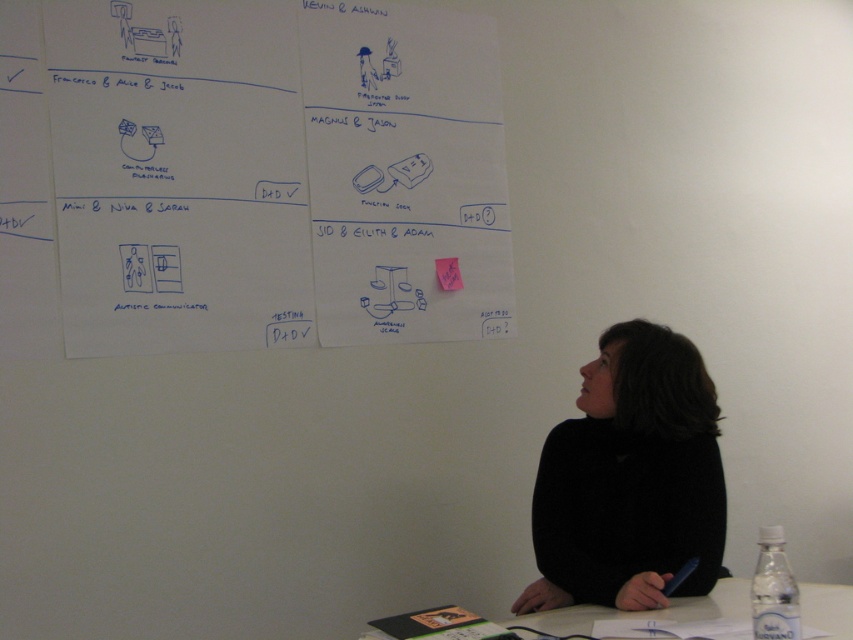
Can you confirm if black matte sweater at lower right is positioned above white plastic table at lower center?

Yes.

Image resolution: width=853 pixels, height=640 pixels. Describe the element at coordinates (630, 477) in the screenshot. I see `black matte sweater at lower right` at that location.

What are the coordinates of `black matte sweater at lower right` in the screenshot? It's located at (630, 477).

I want to click on white plastic table at lower center, so 650,611.

Between white plastic table at lower center and pink paper at center, which one has more height?

white plastic table at lower center

The image size is (853, 640). What are the coordinates of `white plastic table at lower center` in the screenshot? It's located at (650, 611).

This screenshot has width=853, height=640. What are the coordinates of `white plastic table at lower center` in the screenshot? It's located at (650, 611).

Based on the photo, between black matte sweater at lower right and pink paper at center, which one is positioned higher?

pink paper at center is above.

Does black matte sweater at lower right have a greater height compared to pink paper at center?

Yes.

Does point (657, 349) come closer to viewer compared to point (440, 285)?

That is True.

At what (x,y) coordinates should I click in order to perform the action: click on black matte sweater at lower right. Please return your answer as a coordinate pair (x, y). Looking at the image, I should click on (630, 477).